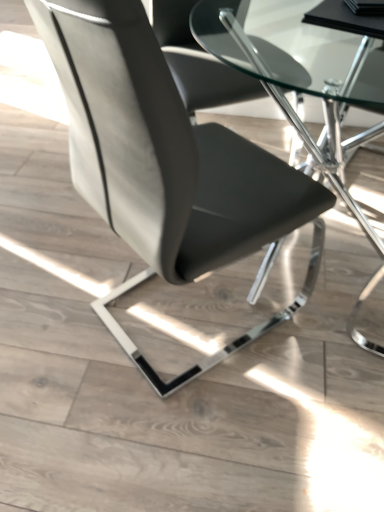
I want to click on free space that is to the left of matte black chair at center, so pos(58,290).